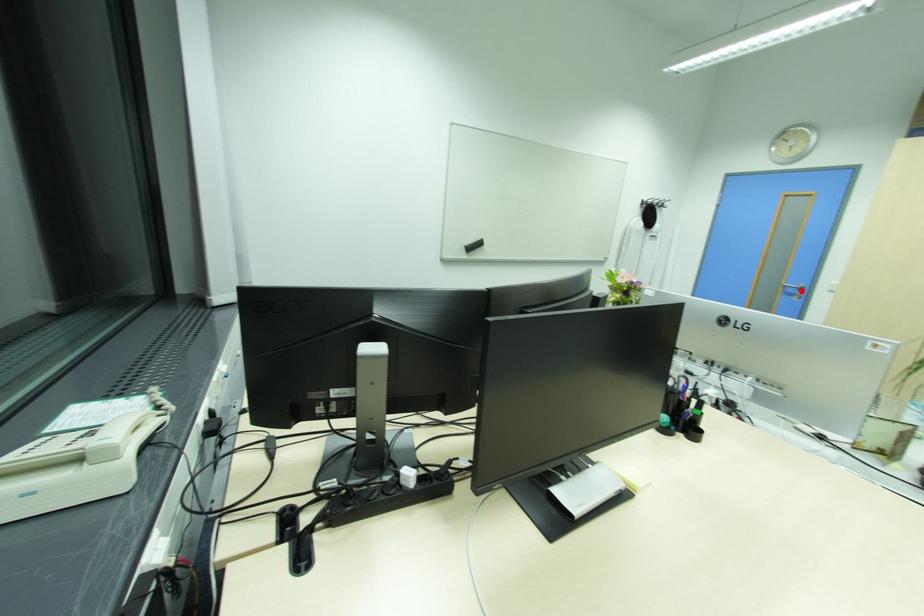
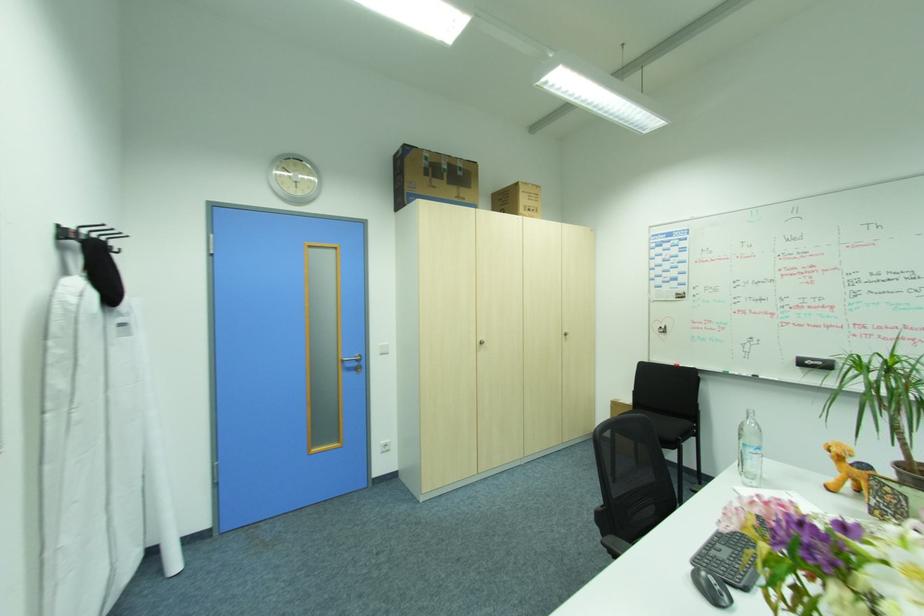
Where in the second image is the point corresponding to the highlighted location from the first image?

(360, 363)